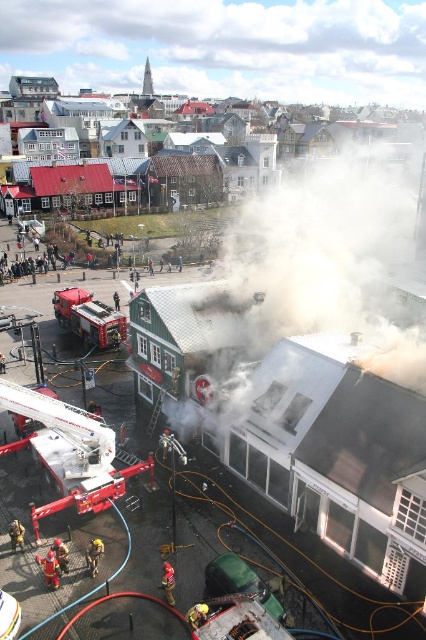
Question: Does metallic red fire truck at center-left appear on the left side of red uniform fireman at lower left?

Choices:
 (A) yes
 (B) no

Answer: (A)

Question: Is black smoke at upper center smaller than red uniform fireman at lower left?

Choices:
 (A) no
 (B) yes

Answer: (A)

Question: Is metallic red fire truck at center-left behind red uniform fireman at lower left?

Choices:
 (A) yes
 (B) no

Answer: (A)

Question: Based on their relative distances, which object is nearer to the metallic red fire truck at center-left?

Choices:
 (A) red uniform fireman at lower left
 (B) red metallic fire truck at lower left

Answer: (B)

Question: Which object appears closest to the camera in this image?

Choices:
 (A) black smoke at upper center
 (B) red uniform fireman at lower left

Answer: (B)

Question: Among these points, which one is nearest to the camera?

Choices:
 (A) (118, 492)
 (B) (331, 172)
 (C) (54, 557)

Answer: (C)